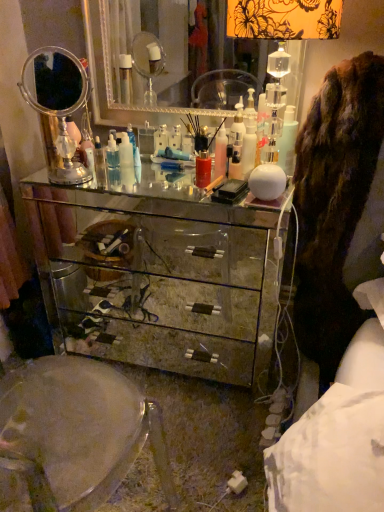
This screenshot has width=384, height=512. What are the coordinates of `vacant area that is in front of clear plastic bottle at center, placed as the 2th toiletry when sorted from front to back` in the screenshot? It's located at (108, 176).